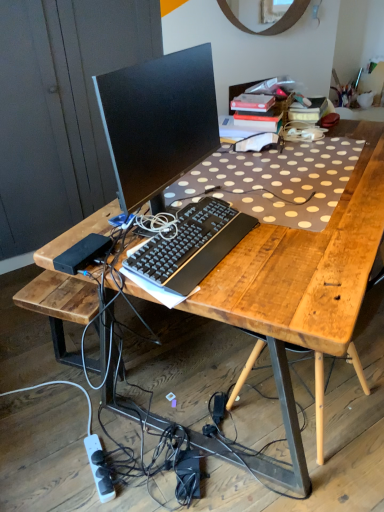
Locate an element on the screen. The image size is (384, 512). vacant space to the right of matte black monitor at center is located at coordinates (283, 217).